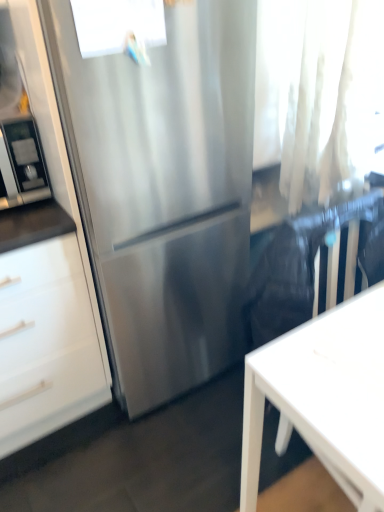
Describe the element at coordinates (119, 27) in the screenshot. I see `transparent glass window at upper center` at that location.

From the picture: Measure the distance between point (10, 170) and camera.

A distance of 1.28 meters exists between point (10, 170) and camera.

Describe the element at coordinates (324, 398) in the screenshot. This screenshot has height=512, width=384. I see `white matte desk at lower right` at that location.

At what (x,y) coordinates should I click in order to perform the action: click on white sheer curtain at upper right. Please return your answer as a coordinate pair (x, y). The height and width of the screenshot is (512, 384). Looking at the image, I should click on (317, 91).

This screenshot has height=512, width=384. I want to click on transparent glass window at upper center, so click(x=119, y=27).

Considering the sizes of objects stainless steel refrigerator at left and transparent glass window at upper center in the image provided, who is wider, stainless steel refrigerator at left or transparent glass window at upper center?

stainless steel refrigerator at left.

Could you tell me if stainless steel refrigerator at left is facing transparent glass window at upper center?

No.

Is point (30, 175) in front of point (160, 5)?

No, (30, 175) is behind (160, 5).

Locate an element on the screen. The width and height of the screenshot is (384, 512). appliance that appears below the transparent glass window at upper center (from the image's perspective) is located at coordinates (23, 162).

Is white matte desk at lower right further to the viewer compared to stainless steel refrigerator at left?

No, white matte desk at lower right is closer to the camera.

Is white matte desk at lower right taller or shorter than stainless steel refrigerator at left?

white matte desk at lower right is taller than stainless steel refrigerator at left.

From the image's perspective, which object appears higher, white matte desk at lower right or stainless steel refrigerator at left?

stainless steel refrigerator at left.

Which is more to the left, white matte desk at lower right or stainless steel refrigerator at left?

Positioned to the left is stainless steel refrigerator at left.

From a real-world perspective, is stainless steel refrigerator at center above or below stainless steel refrigerator at left?

Clearly, from a real-world perspective, stainless steel refrigerator at center is below stainless steel refrigerator at left.

Looking at this image, from the image's perspective, is stainless steel refrigerator at center on stainless steel refrigerator at left?

No, from the image's perspective, stainless steel refrigerator at center is not above stainless steel refrigerator at left.

In terms of size, does stainless steel refrigerator at center appear bigger or smaller than stainless steel refrigerator at left?

stainless steel refrigerator at center is bigger than stainless steel refrigerator at left.

Is stainless steel refrigerator at left surrounded by stainless steel refrigerator at center?

No, stainless steel refrigerator at left is not surrounded by stainless steel refrigerator at center.

Is stainless steel refrigerator at center facing towards white sheer curtain at upper right?

No.

Can you confirm if stainless steel refrigerator at center is shorter than white sheer curtain at upper right?

Incorrect, the height of stainless steel refrigerator at center does not fall short of that of white sheer curtain at upper right.

Which point is more forward, (157, 120) or (295, 195)?

The point (157, 120) is closer.

From the image's perspective, does stainless steel refrigerator at center appear lower than white sheer curtain at upper right?

Yes.

Is white matte desk at lower right far away from stainless steel refrigerator at center?

That's not correct — white matte desk at lower right is a little close to stainless steel refrigerator at center.

How many degrees apart are the facing directions of white matte desk at lower right and stainless steel refrigerator at center?

The angle between the facing direction of white matte desk at lower right and the facing direction of stainless steel refrigerator at center is 90.4 degrees.

Is white matte desk at lower right looking in the opposite direction of stainless steel refrigerator at center?

No, white matte desk at lower right is not facing away from stainless steel refrigerator at center.

From the picture: Considering the relative sizes of transparent glass window at upper center and stainless steel refrigerator at left in the image provided, is transparent glass window at upper center smaller than stainless steel refrigerator at left?

Indeed, transparent glass window at upper center has a smaller size compared to stainless steel refrigerator at left.

You are a GUI agent. You are given a task and a screenshot of the screen. Output one action in this format:
    pyautogui.click(x=<x>, y=<y>)
    Task: Click on the window that is on the right side of stainless steel refrigerator at left
    
    Given the screenshot: What is the action you would take?
    pyautogui.click(x=119, y=27)

From the image's perspective, is transparent glass window at upper center above or below stainless steel refrigerator at left?

Clearly, from the image's perspective, transparent glass window at upper center is above stainless steel refrigerator at left.

Which is closer, (107, 22) or (316, 445)?

Point (107, 22)

Is transparent glass window at upper center smaller than white matte desk at lower right?

Yes, transparent glass window at upper center is smaller than white matte desk at lower right.

In the scene shown: Which is more to the right, transparent glass window at upper center or white matte desk at lower right?

white matte desk at lower right.

From a real-world perspective, is transparent glass window at upper center over white matte desk at lower right?

Yes.

At what (x,y) coordinates should I click in order to perform the action: click on window in front of the stainless steel refrigerator at left. Please return your answer as a coordinate pair (x, y). This screenshot has width=384, height=512. Looking at the image, I should click on (119, 27).

Locate an element on the screen. desk below the stainless steel refrigerator at left (from a real-world perspective) is located at coordinates (324, 398).

From the image, which object appears to be farther from white matte desk at lower right, stainless steel refrigerator at left or transparent glass window at upper center?

stainless steel refrigerator at left.

In the scene shown: Looking at the image, which one is located further to transparent glass window at upper center, stainless steel refrigerator at center or stainless steel refrigerator at left?

Based on the image, stainless steel refrigerator at center appears to be further to transparent glass window at upper center.

When comparing their distances from stainless steel refrigerator at left, does white matte desk at lower right or stainless steel refrigerator at center seem further?

The object further to stainless steel refrigerator at left is white matte desk at lower right.

Considering their positions, is white sheer curtain at upper right positioned closer to stainless steel refrigerator at center than white matte desk at lower right?

Among the two, white sheer curtain at upper right is located nearer to stainless steel refrigerator at center.

Estimate the real-world distances between objects in this image. Which object is further from stainless steel refrigerator at center, white matte desk at lower right or white sheer curtain at upper right?

white matte desk at lower right lies further to stainless steel refrigerator at center than the other object.

Based on their spatial positions, is stainless steel refrigerator at left or white matte desk at lower right closer to white sheer curtain at upper right?

Based on the image, white matte desk at lower right appears to be nearer to white sheer curtain at upper right.

Estimate the real-world distances between objects in this image. Which object is further from white sheer curtain at upper right, white matte desk at lower right or stainless steel refrigerator at center?

white matte desk at lower right.

Consider the image. Estimate the real-world distances between objects in this image. Which object is further from white matte desk at lower right, stainless steel refrigerator at center or stainless steel refrigerator at left?

Among the two, stainless steel refrigerator at left is located further to white matte desk at lower right.

Identify the location of refrigerator located between transparent glass window at upper center and white sheer curtain at upper right in the left-right direction. (164, 191).

I want to click on refrigerator that lies between white sheer curtain at upper right and white matte desk at lower right from top to bottom, so click(164, 191).

The height and width of the screenshot is (512, 384). Identify the location of window between stainless steel refrigerator at left and white matte desk at lower right from left to right. (119, 27).

Locate an element on the screen. The height and width of the screenshot is (512, 384). curtain between transparent glass window at upper center and white matte desk at lower right vertically is located at coordinates (317, 91).